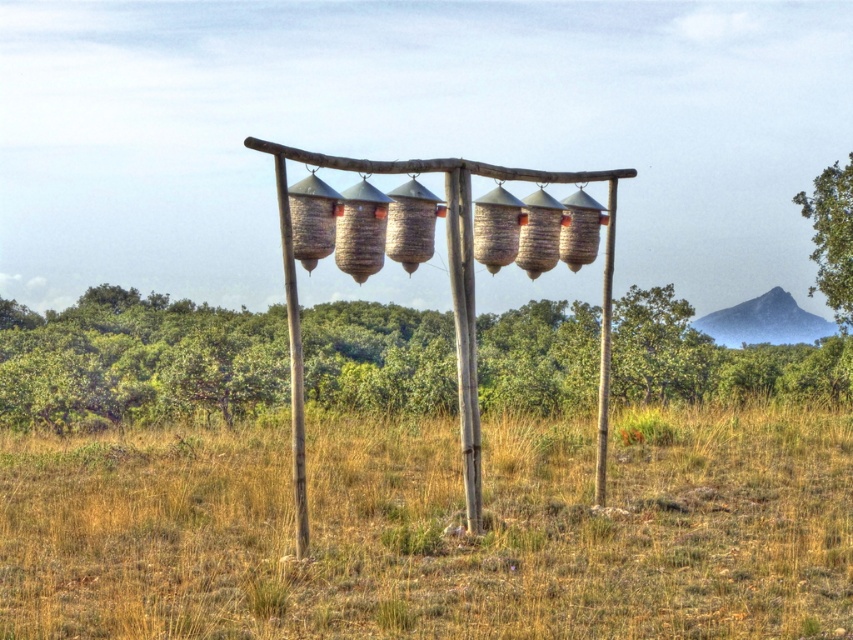
You are standing in the middle of the field and see the dry grass at center and the green leafy tree at center. Which object is positioned to the left of the other?

The dry grass at center is to the left of the green leafy tree at center.

You are a birdwatcher trying to choose between two trees for a better view of the feeders. The green leafy tree at center and the green leafy tree at upper right are both in the background. Which tree has a wider spread of branches to provide more shade?

The green leafy tree at center has a larger width than the green leafy tree at upper right, so it provides a wider spread of branches and more shade.

Consider the image. You are standing in the middle of the grassy field looking at the wooden structure with six feeders. There are two points marked on the feeders. Which point, point (711, 448) or point (801, 371), is closer to you?

Point (711, 448) is closer to the viewer than point (801, 371).